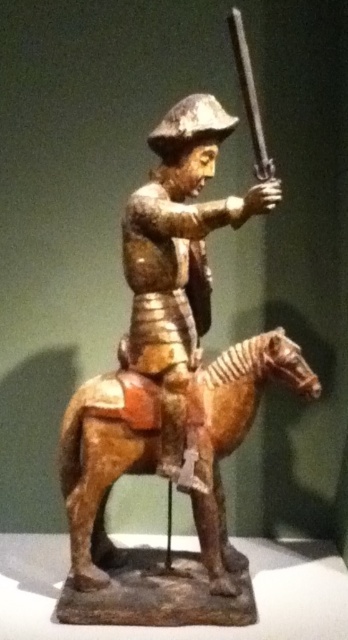
Consider the image. You are an art restorer examining the mounted warrior figurine. You notice two points on the figurine labeled as point 1 at coordinates (159, 348) and point 2 at coordinates (254, 150). Which point is positioned closer to your viewpoint?

Point 1 at coordinates (159, 348) is closer to the viewer than point 2 at coordinates (254, 150).

You are an art restorer examining the mounted warrior figurine. You need to determine the relative positions of the wooden horse at center and the wooden figure at center to ensure proper restoration. According to the image, which object is positioned to the left?

The wooden horse at center is to the left of the wooden figure at center, so the wooden horse at center is positioned to the left.